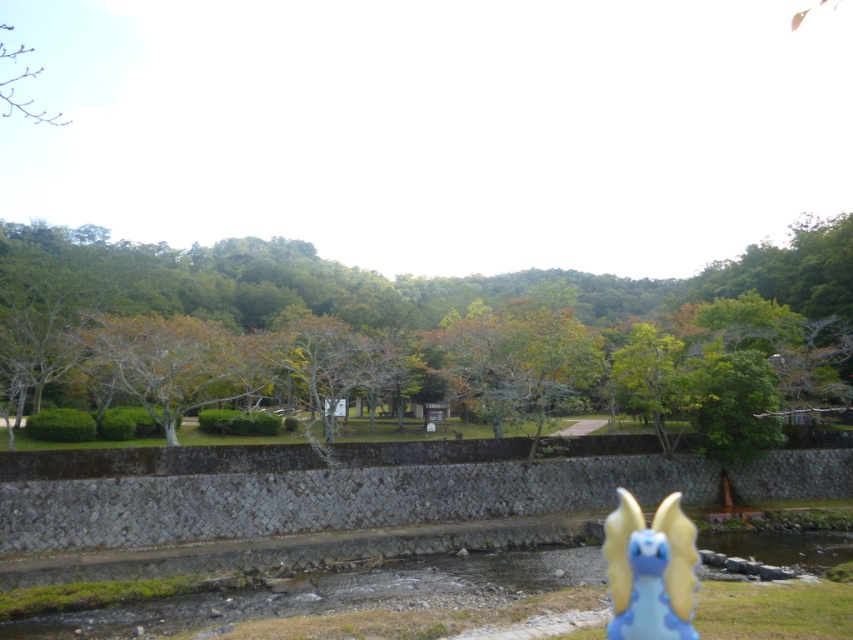
Who is positioned more to the left, green leafy tree at center or blue rubber dragon at lower right?

From the viewer's perspective, green leafy tree at center appears more on the left side.

Who is positioned more to the right, green leafy tree at center or blue rubber dragon at lower right?

blue rubber dragon at lower right

Between point (51, 372) and point (636, 588), which one is positioned in front?

Positioned in front is point (636, 588).

Locate an element on the screen. This screenshot has width=853, height=640. green leafy tree at center is located at coordinates (373, 285).

Who is shorter, blue rubber dragon at lower right or bare branches at upper left?

Standing shorter between the two is blue rubber dragon at lower right.

Does blue rubber dragon at lower right come in front of bare branches at upper left?

That is True.

Does point (633, 516) lie behind point (4, 113)?

No, (633, 516) is in front of (4, 113).

You are a GUI agent. You are given a task and a screenshot of the screen. Output one action in this format:
    pyautogui.click(x=<x>, y=<y>)
    Task: Click on the blue rubber dragon at lower right
    The image size is (853, 640).
    Given the screenshot: What is the action you would take?
    pyautogui.click(x=648, y=570)

In the scene shown: Is green leafy tree at center in front of bare branches at upper left?

Yes, it is in front of bare branches at upper left.

Between green leafy tree at center and bare branches at upper left, which one appears on the right side from the viewer's perspective?

Positioned to the right is green leafy tree at center.

Which is in front, point (755, 296) or point (22, 74)?

Point (755, 296)

In order to click on green leafy tree at center in this screenshot , I will do `click(373, 285)`.